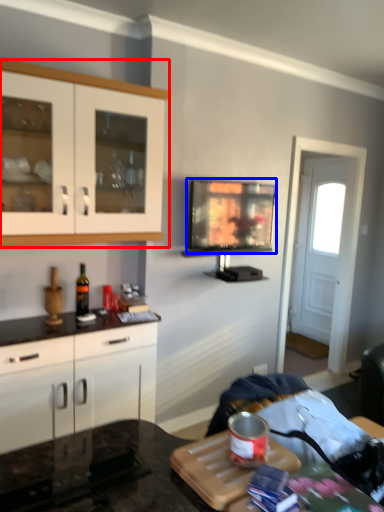
Question: Which object is further to the camera taking this photo, cabinetry (highlighted by a red box) or television (highlighted by a blue box)?

Choices:
 (A) cabinetry
 (B) television

Answer: (B)